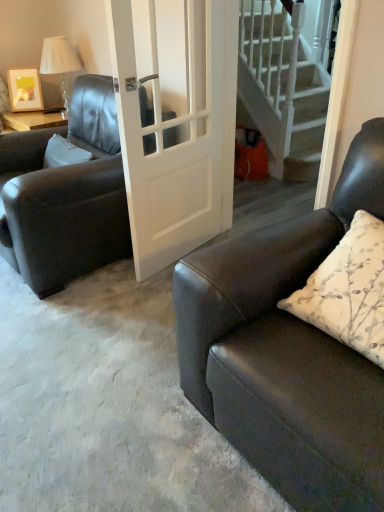
Question: Does matte black couch at right have a smaller size compared to white glossy door at center?

Choices:
 (A) no
 (B) yes

Answer: (A)

Question: From a real-world perspective, is matte black couch at right positioned over white glossy door at center based on gravity?

Choices:
 (A) no
 (B) yes

Answer: (A)

Question: Considering the relative sizes of matte black couch at right and white glossy door at center in the image provided, is matte black couch at right wider than white glossy door at center?

Choices:
 (A) no
 (B) yes

Answer: (B)

Question: Is matte black couch at right positioned with its back to white glossy door at center?

Choices:
 (A) no
 (B) yes

Answer: (A)

Question: Considering the relative sizes of matte black couch at right and white glossy door at center in the image provided, is matte black couch at right shorter than white glossy door at center?

Choices:
 (A) yes
 (B) no

Answer: (A)

Question: Considering the relative positions of white wooden stairs at upper right and matte black couch at right in the image provided, is white wooden stairs at upper right to the left or to the right of matte black couch at right?

Choices:
 (A) left
 (B) right

Answer: (B)

Question: In the image, is white wooden stairs at upper right positioned in front of or behind matte black couch at right?

Choices:
 (A) behind
 (B) front

Answer: (A)

Question: From the image's perspective, is white wooden stairs at upper right above or below matte black couch at right?

Choices:
 (A) below
 (B) above

Answer: (B)

Question: Would you say white wooden stairs at upper right is inside or outside matte black couch at right?

Choices:
 (A) inside
 (B) outside

Answer: (B)

Question: From a real-world perspective, relative to wooden picture frame at upper left, is white wooden stairs at upper right vertically above or below?

Choices:
 (A) above
 (B) below

Answer: (B)

Question: Relative to wooden picture frame at upper left, is white wooden stairs at upper right in front or behind?

Choices:
 (A) behind
 (B) front

Answer: (B)

Question: From the image's perspective, is white wooden stairs at upper right located above or below wooden picture frame at upper left?

Choices:
 (A) below
 (B) above

Answer: (B)

Question: Is white wooden stairs at upper right wider or thinner than wooden picture frame at upper left?

Choices:
 (A) wide
 (B) thin

Answer: (B)

Question: Is white fabric lampshade at upper left in front of or behind white glossy door at center in the image?

Choices:
 (A) behind
 (B) front

Answer: (A)

Question: From the image's perspective, is white fabric lampshade at upper left located above or below white glossy door at center?

Choices:
 (A) above
 (B) below

Answer: (A)